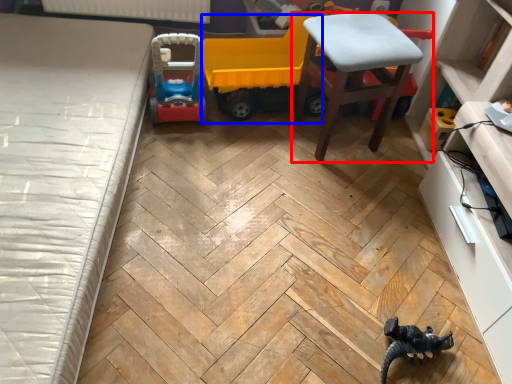
Question: Among these objects, which one is farthest to the camera, chair (highlighted by a red box) or model car (highlighted by a blue box)?

Choices:
 (A) chair
 (B) model car

Answer: (B)